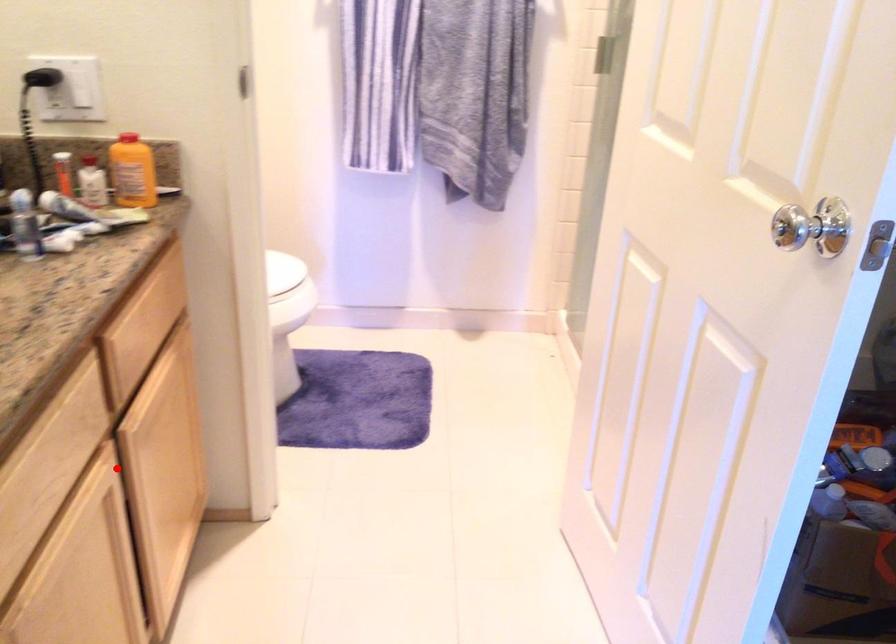
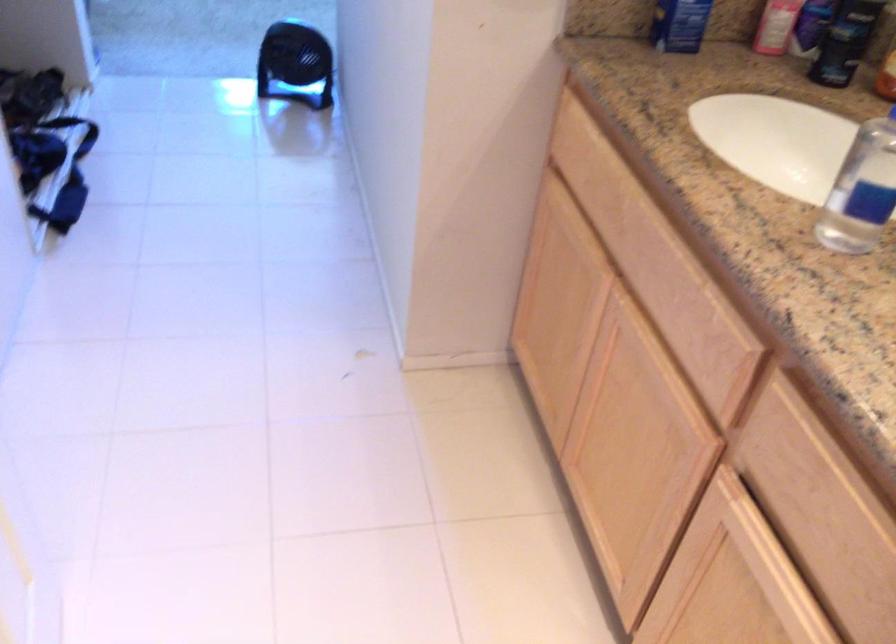
Question: I am providing you with two images of the same scene from different viewpoints. Image1 has a red point marked. In image2, the corresponding 3D location appears at what relative position? Reply with the corresponding letter.

Choices:
 (A) Closer
 (B) Farther

Answer: (A)